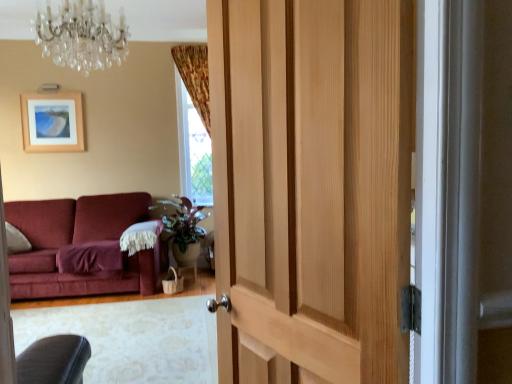
Question: Considering the relative sizes of crystal glass chandelier at upper center and wooden picture frame at upper left in the image provided, is crystal glass chandelier at upper center shorter than wooden picture frame at upper left?

Choices:
 (A) yes
 (B) no

Answer: (A)

Question: From the image's perspective, is crystal glass chandelier at upper center under wooden picture frame at upper left?

Choices:
 (A) yes
 (B) no

Answer: (B)

Question: Considering the relative positions of crystal glass chandelier at upper center and wooden picture frame at upper left in the image provided, is crystal glass chandelier at upper center to the left of wooden picture frame at upper left from the viewer's perspective?

Choices:
 (A) yes
 (B) no

Answer: (B)

Question: Considering the relative sizes of crystal glass chandelier at upper center and wooden picture frame at upper left in the image provided, is crystal glass chandelier at upper center bigger than wooden picture frame at upper left?

Choices:
 (A) yes
 (B) no

Answer: (A)

Question: Would you say crystal glass chandelier at upper center is a long distance from wooden picture frame at upper left?

Choices:
 (A) no
 (B) yes

Answer: (B)

Question: From the image's perspective, is crystal glass chandelier at upper center on top of wooden picture frame at upper left?

Choices:
 (A) no
 (B) yes

Answer: (B)

Question: Is wooden picture frame at upper left shorter than green matte plant at center?

Choices:
 (A) no
 (B) yes

Answer: (B)

Question: Is green matte plant at center a part of wooden picture frame at upper left?

Choices:
 (A) yes
 (B) no

Answer: (B)

Question: Is wooden picture frame at upper left facing towards green matte plant at center?

Choices:
 (A) yes
 (B) no

Answer: (B)

Question: From a real-world perspective, is wooden picture frame at upper left under green matte plant at center?

Choices:
 (A) yes
 (B) no

Answer: (B)

Question: Is wooden picture frame at upper left not inside green matte plant at center?

Choices:
 (A) yes
 (B) no

Answer: (A)

Question: Is wooden picture frame at upper left not near green matte plant at center?

Choices:
 (A) yes
 (B) no

Answer: (A)

Question: From the image's perspective, does green matte plant at center appear lower than wooden picture frame at upper left?

Choices:
 (A) yes
 (B) no

Answer: (A)